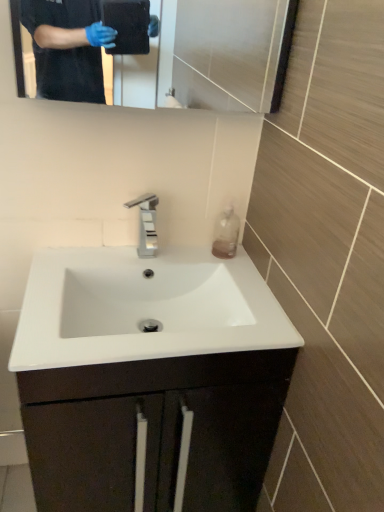
Question: Can you confirm if glossy metallic mirror at upper center is thinner than translucent plastic bottle at right?

Choices:
 (A) no
 (B) yes

Answer: (A)

Question: From the image's perspective, is glossy metallic mirror at upper center on top of translucent plastic bottle at right?

Choices:
 (A) yes
 (B) no

Answer: (A)

Question: Is glossy metallic mirror at upper center to the left of translucent plastic bottle at right from the viewer's perspective?

Choices:
 (A) no
 (B) yes

Answer: (B)

Question: Is glossy metallic mirror at upper center taller than translucent plastic bottle at right?

Choices:
 (A) no
 (B) yes

Answer: (B)

Question: Considering the relative sizes of glossy metallic mirror at upper center and translucent plastic bottle at right in the image provided, is glossy metallic mirror at upper center smaller than translucent plastic bottle at right?

Choices:
 (A) no
 (B) yes

Answer: (A)

Question: Considering the positions of translucent plastic bottle at right and white glossy sink at center in the image, is translucent plastic bottle at right taller or shorter than white glossy sink at center?

Choices:
 (A) tall
 (B) short

Answer: (B)

Question: Is translucent plastic bottle at right bigger or smaller than white glossy sink at center?

Choices:
 (A) small
 (B) big

Answer: (A)

Question: In terms of width, does translucent plastic bottle at right look wider or thinner when compared to white glossy sink at center?

Choices:
 (A) wide
 (B) thin

Answer: (B)

Question: From a real-world perspective, relative to white glossy sink at center, is translucent plastic bottle at right vertically above or below?

Choices:
 (A) above
 (B) below

Answer: (A)

Question: From the image's perspective, is white glossy sink at center positioned above or below white glossy sink at center?

Choices:
 (A) above
 (B) below

Answer: (A)

Question: Looking at the image, does white glossy sink at center seem bigger or smaller compared to white glossy sink at center?

Choices:
 (A) small
 (B) big

Answer: (A)

Question: Is white glossy sink at center inside or outside of white glossy sink at center?

Choices:
 (A) inside
 (B) outside

Answer: (A)

Question: Considering their positions, is white glossy sink at center located in front of or behind white glossy sink at center?

Choices:
 (A) behind
 (B) front

Answer: (A)

Question: From a real-world perspective, is glossy metallic mirror at upper center above or below white glossy sink at center?

Choices:
 (A) below
 (B) above

Answer: (B)

Question: Is glossy metallic mirror at upper center in front of or behind white glossy sink at center in the image?

Choices:
 (A) behind
 (B) front

Answer: (A)